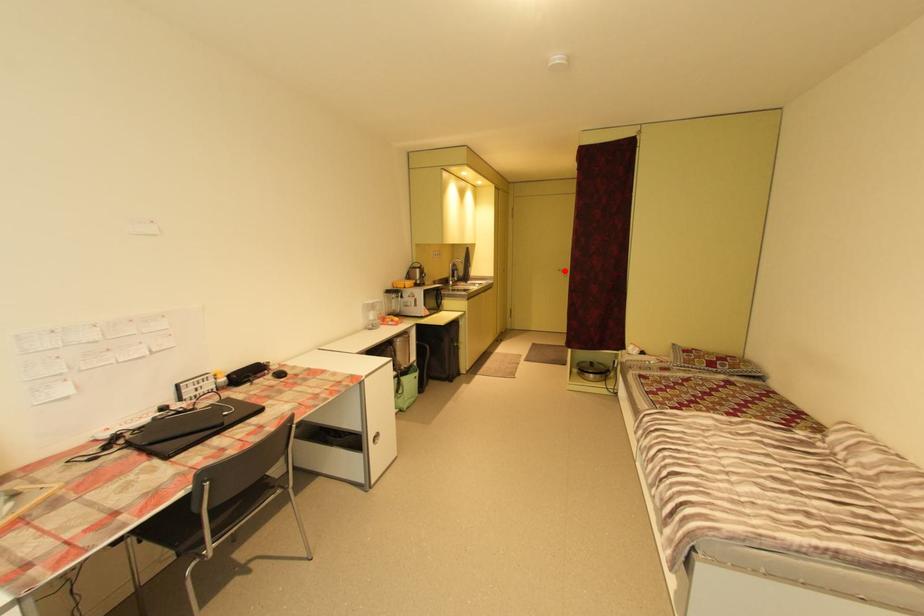
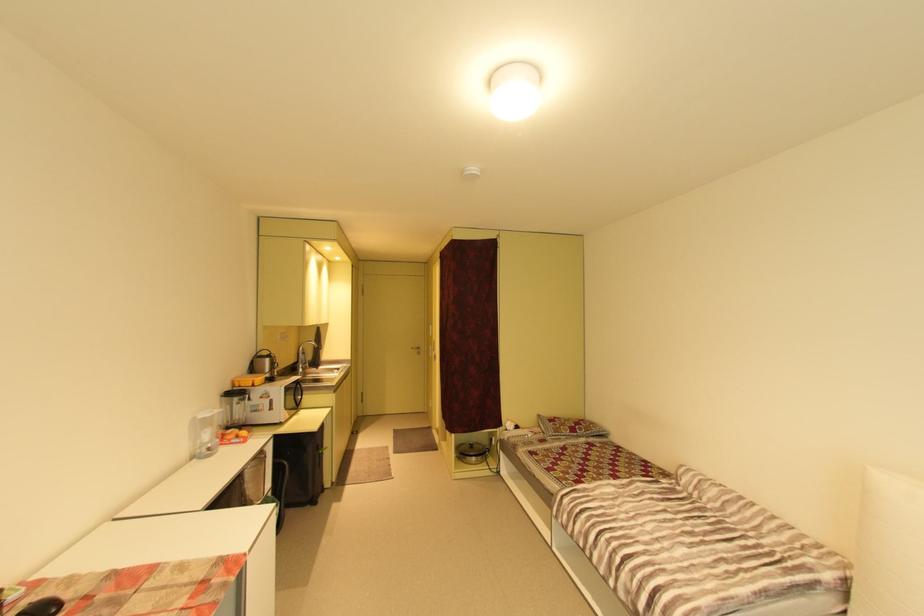
Question: A red point is marked in image1. In image2, is the corresponding 3D point closer to the camera or farther? Reply with the corresponding letter.

Choices:
 (A) The corresponding 3D point is closer.
 (B) The corresponding 3D point is farther.

Answer: (B)